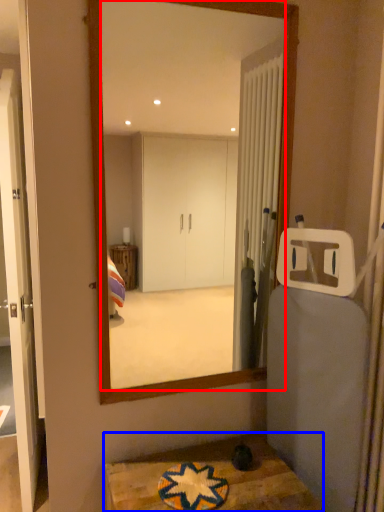
Question: Which object is closer to the camera taking this photo, mirror (highlighted by a red box) or table (highlighted by a blue box)?

Choices:
 (A) mirror
 (B) table

Answer: (B)